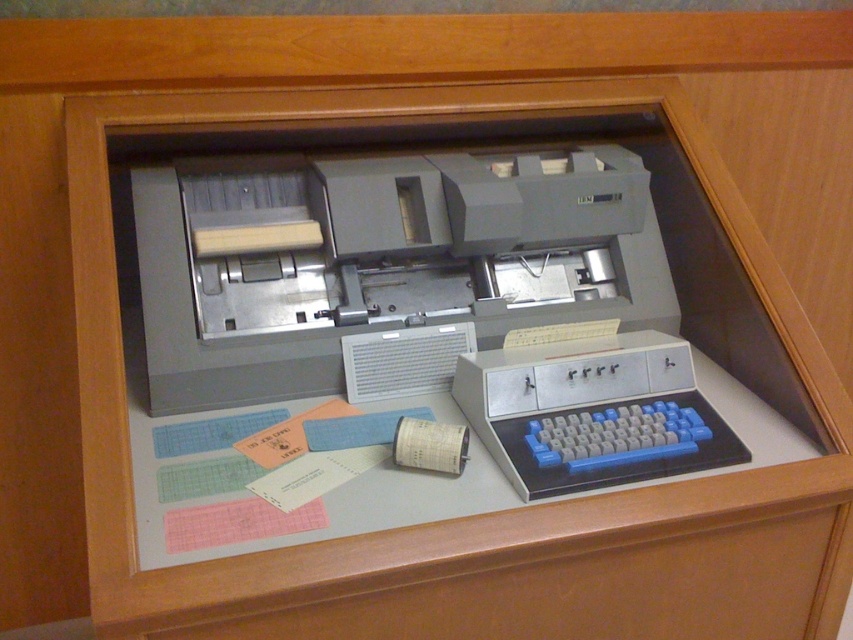
You are a technician who needs to connect the blue plastic keyboard at center to the matte gray printer at center. The cable you have is 8 inches long. Will the cable be long enough to connect them?

The matte gray printer at center and blue plastic keyboard at center are 9.14 inches apart from each other. The cable is only 8 inches long, so it will not be long enough to connect them.

You are a technician trying to access the keyboard in the image. The matte gray printer at center is blocking your path. Can you move around the printer to reach the blue plastic keyboard at center?

The matte gray printer at center is to the left of the blue plastic keyboard at center, so you can move around the right side of the printer to reach the blue plastic keyboard at center.

You are standing in front of the vintage IBM 1403 printer and need to locate two points marked in the image. The first point is at coordinates point [573,285] and the second is at point [683,381]. Which of these points is closer to you?

Point [683,381] is closer to you because it is in front of point [573,285].